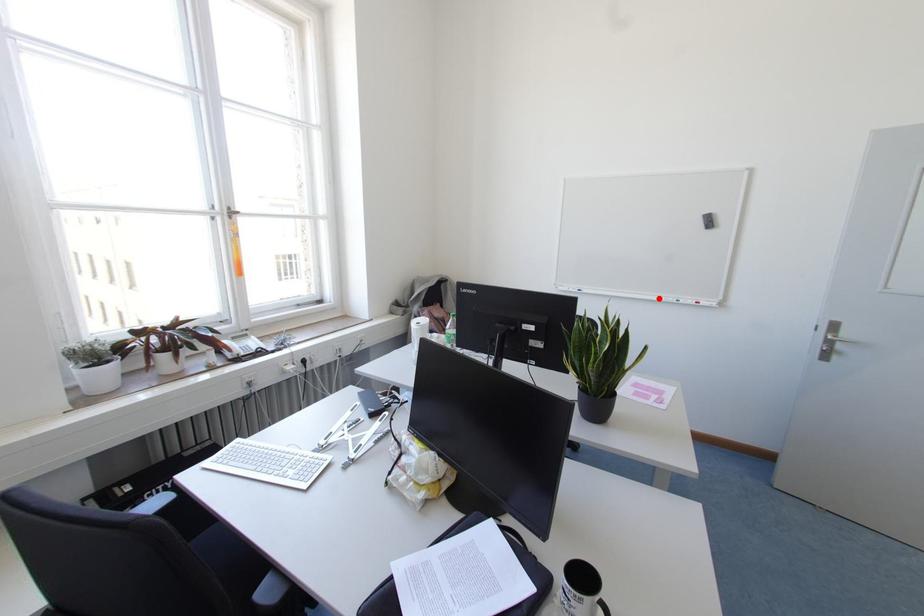
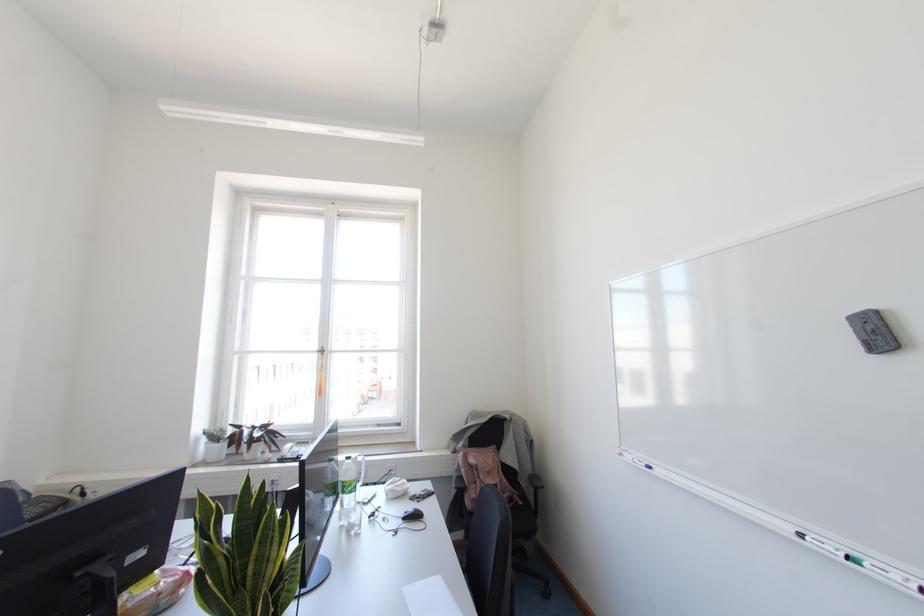
Question: I am providing you with two images of the same scene from different viewpoints. A red point is marked on the first image. At the location where the point appears in image 1, is it still visible in image 2?

Choices:
 (A) Yes
 (B) No

Answer: (A)